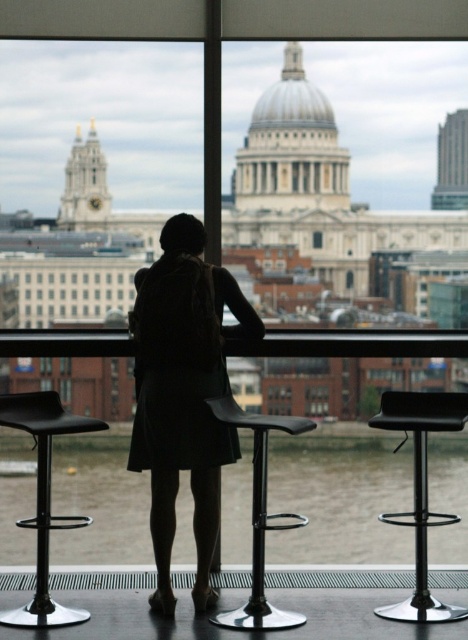
Question: Is black fabric coat at center bigger than black matte bar stool at center?

Choices:
 (A) yes
 (B) no

Answer: (A)

Question: Can you confirm if black fabric coat at center is positioned below black matte bar stool at center?

Choices:
 (A) no
 (B) yes

Answer: (A)

Question: Estimate the real-world distances between objects in this image. Which object is closer to the black leather bar stool at center?

Choices:
 (A) black fabric coat at center
 (B) black matte bar stool at center

Answer: (B)

Question: Is black leather bar stool at center smaller than black matte bar stool at center?

Choices:
 (A) yes
 (B) no

Answer: (A)

Question: Which point is farther to the camera?

Choices:
 (A) (39, 524)
 (B) (199, 586)
 (C) (465, 401)

Answer: (C)

Question: Based on their relative distances, which object is farther from the black leather bar stool at center?

Choices:
 (A) black matte bar stool at center
 (B) black fabric coat at center
 (C) black plastic bar stool at lower left

Answer: (C)